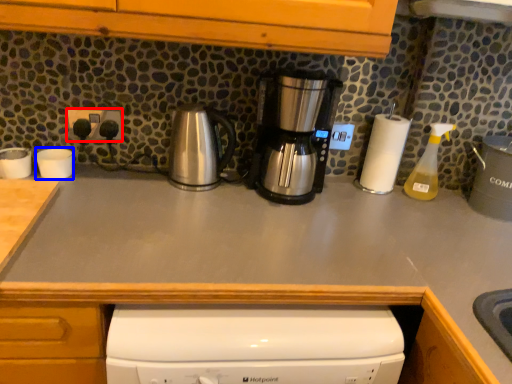
Question: Which object is further to the camera taking this photo, electric outlet (highlighted by a red box) or appliance (highlighted by a blue box)?

Choices:
 (A) electric outlet
 (B) appliance

Answer: (A)